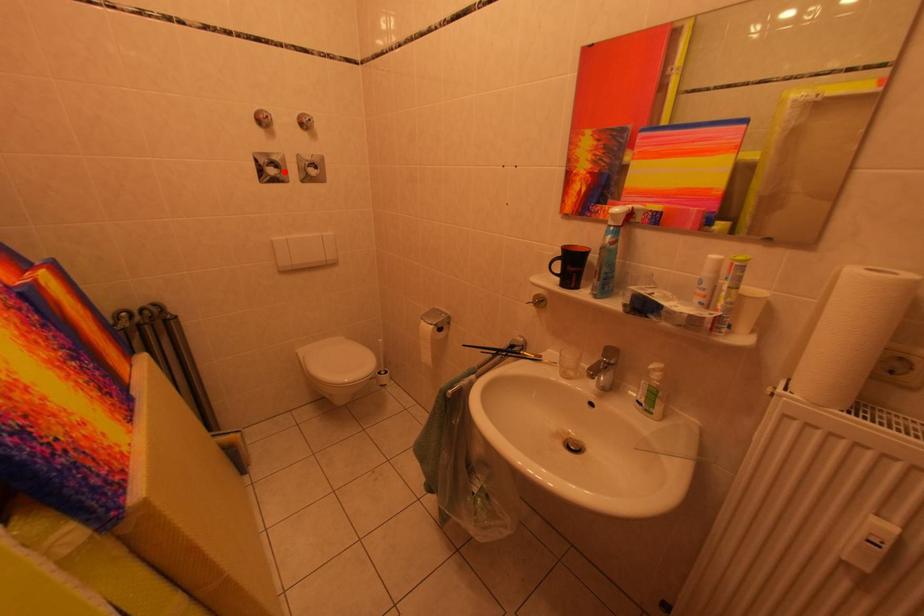
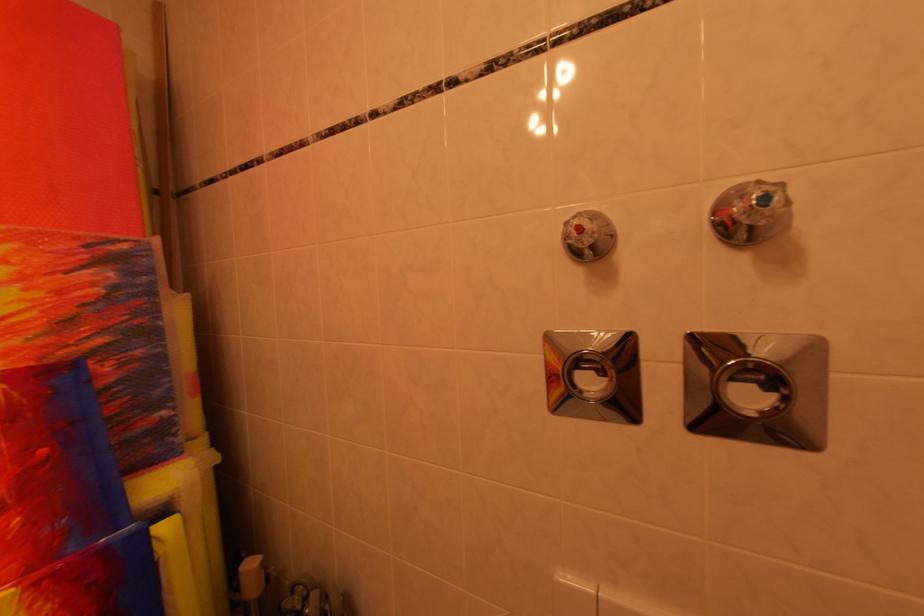
In the second image, find the point that corresponds to the highlighted location in the first image.

(608, 379)